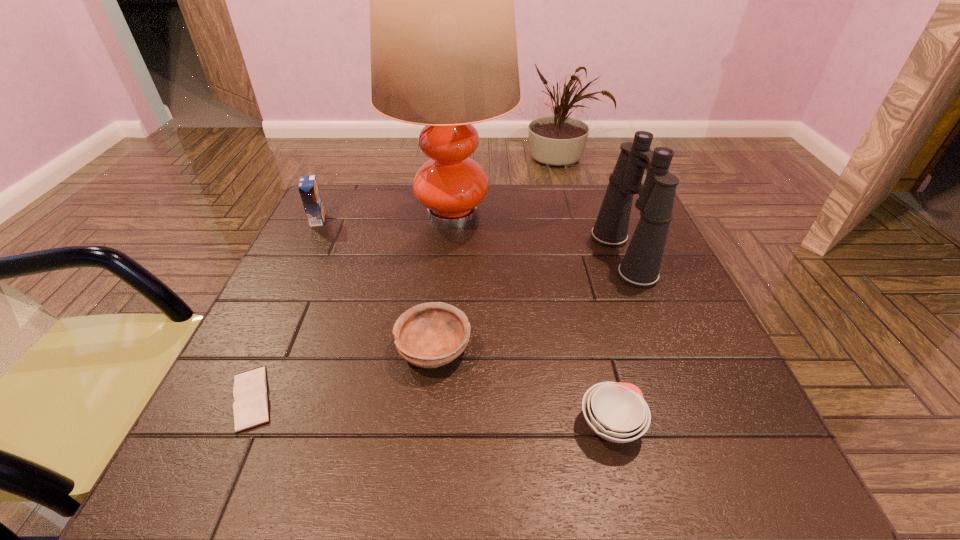
Identify the location of lamp. [443, 43].

Locate an element on the screen. This screenshot has width=960, height=540. the fifth shortest object is located at coordinates (640, 266).

Locate an element on the screen. The image size is (960, 540). the rightmost object is located at coordinates (640, 266).

This screenshot has height=540, width=960. What are the coordinates of `the fourth shortest object` in the screenshot? It's located at (308, 187).

Image resolution: width=960 pixels, height=540 pixels. I want to click on bowl, so click(x=429, y=335).

The height and width of the screenshot is (540, 960). Find the location of `the second object from right to left`. the second object from right to left is located at coordinates (617, 412).

The width and height of the screenshot is (960, 540). I want to click on diary, so click(250, 408).

Where is `vacant space located on the front of the tallest object`? Image resolution: width=960 pixels, height=540 pixels. vacant space located on the front of the tallest object is located at coordinates (442, 340).

Where is `vacant region located 0.230m on the left of the rightmost object`? vacant region located 0.230m on the left of the rightmost object is located at coordinates (499, 256).

You are a GUI agent. You are given a task and a screenshot of the screen. Output one action in this format:
    pyautogui.click(x=<x>, y=<y>)
    Task: Click on the vacant area situated 0.400m on the right of the orange_juice
    The image size is (960, 540).
    Given the screenshot: What is the action you would take?
    click(x=480, y=220)